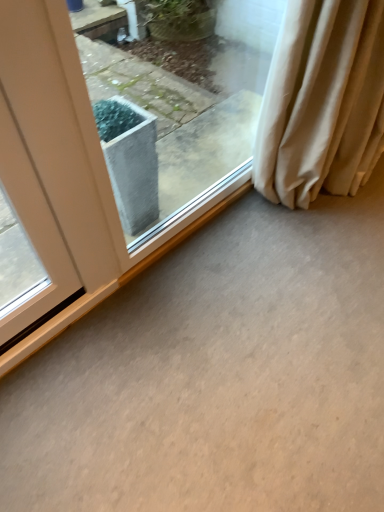
Question: Does gray concrete at center turn towards transparent glass window at center?

Choices:
 (A) no
 (B) yes

Answer: (A)

Question: Would you say gray concrete at center contains transparent glass window at center?

Choices:
 (A) yes
 (B) no

Answer: (B)

Question: Considering the relative positions of gray concrete at center and transparent glass window at center in the image provided, is gray concrete at center to the right of transparent glass window at center from the viewer's perspective?

Choices:
 (A) no
 (B) yes

Answer: (B)

Question: From the image's perspective, would you say gray concrete at center is positioned over transparent glass window at center?

Choices:
 (A) yes
 (B) no

Answer: (B)

Question: Does gray concrete at center appear on the left side of transparent glass window at center?

Choices:
 (A) no
 (B) yes

Answer: (A)

Question: Considering the positions of point click(x=322, y=72) and point click(x=86, y=79), is point click(x=322, y=72) closer or farther from the camera than point click(x=86, y=79)?

Choices:
 (A) farther
 (B) closer

Answer: (B)

Question: Is beige fabric curtain at right to the left or to the right of transparent glass window at center in the image?

Choices:
 (A) left
 (B) right

Answer: (B)

Question: From the image's perspective, is beige fabric curtain at right positioned above or below transparent glass window at center?

Choices:
 (A) below
 (B) above

Answer: (B)

Question: In terms of height, does beige fabric curtain at right look taller or shorter compared to transparent glass window at center?

Choices:
 (A) tall
 (B) short

Answer: (B)

Question: Considering their positions, is gray concrete at center located in front of or behind beige fabric curtain at right?

Choices:
 (A) front
 (B) behind

Answer: (A)

Question: From their relative heights in the image, would you say gray concrete at center is taller or shorter than beige fabric curtain at right?

Choices:
 (A) tall
 (B) short

Answer: (B)

Question: From a real-world perspective, is gray concrete at center positioned above or below beige fabric curtain at right?

Choices:
 (A) below
 (B) above

Answer: (A)

Question: Would you say gray concrete at center is to the left or to the right of beige fabric curtain at right in the picture?

Choices:
 (A) right
 (B) left

Answer: (B)

Question: From a real-world perspective, is beige fabric curtain at right physically located above or below gray concrete at center?

Choices:
 (A) below
 (B) above

Answer: (B)

Question: Do you think beige fabric curtain at right is within gray concrete at center, or outside of it?

Choices:
 (A) inside
 (B) outside

Answer: (B)